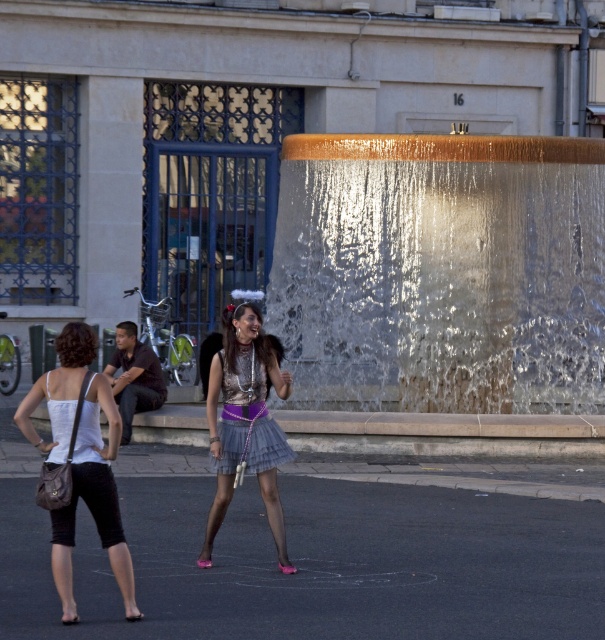
You are a photographer trying to capture both the white fabric dress at lower left and the shiny purple fabric dress at center in a single shot. Based on their positions, which dress is closer to the camera?

The white fabric dress at lower left is positioned under the shiny purple fabric dress at center, so it is closer to the camera.

You are standing at the center of the square and want to find the white fabric tank top at lower left. Based on the coordinates provided, in which direction should you look to locate it?

The white fabric tank top at lower left is located at coordinates point (93, 500), which means you should look to the lower left direction from your current position at the center of the square.

You are standing in the public square and want to take a photo of the translucent glass waterfall at center. To ensure the fountain is the main focus, where should you position yourself relative to the fountain?

The translucent glass waterfall at center is located at point (442, 273), so you should position yourself directly in front of the fountain to capture it as the main focus in your photo.